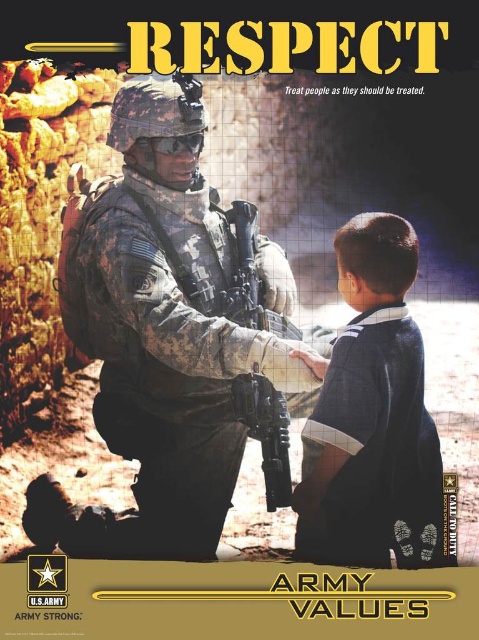
Can you confirm if camouflage uniform at center is positioned below dark blue shirt at right?

Actually, camouflage uniform at center is above dark blue shirt at right.

Does camouflage uniform at center have a larger size compared to dark blue shirt at right?

Indeed, camouflage uniform at center has a larger size compared to dark blue shirt at right.

Is point (126, 456) less distant than point (362, 422)?

No, it is behind (362, 422).

Where is `camouflage uniform at center`? This screenshot has height=640, width=479. camouflage uniform at center is located at coordinates (x=171, y=339).

Is point (251, 348) behind point (278, 500)?

No, (251, 348) is in front of (278, 500).

Does camouflage uniform at center have a lesser height compared to matte black rifle at center?

In fact, camouflage uniform at center may be taller than matte black rifle at center.

Measure the distance between point (76, 538) and camera.

They are 3.09 meters apart.

This screenshot has width=479, height=640. I want to click on camouflage uniform at center, so click(x=171, y=339).

In the scene shown: Is dark blue shirt at right thinner than matte black rifle at center?

No.

Does point (369, 483) lie behind point (271, 412)?

No, (369, 483) is closer to viewer.

What do you see at coordinates (372, 417) in the screenshot? I see `dark blue shirt at right` at bounding box center [372, 417].

Locate an element on the screen. dark blue shirt at right is located at coordinates (372, 417).